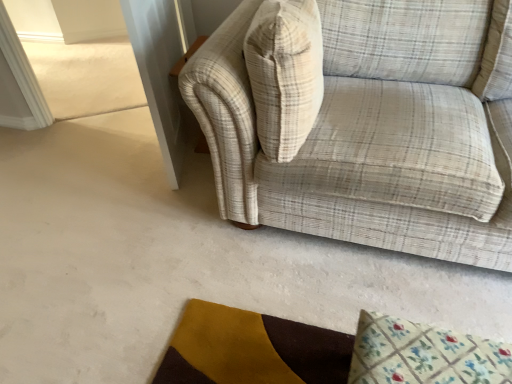
Question: Does plaid fabric couch at upper right have a greater height compared to floral fabric mat at lower right?

Choices:
 (A) no
 (B) yes

Answer: (B)

Question: Is the surface of plaid fabric couch at upper right in direct contact with floral fabric mat at lower right?

Choices:
 (A) no
 (B) yes

Answer: (A)

Question: From the image's perspective, is plaid fabric couch at upper right over floral fabric mat at lower right?

Choices:
 (A) yes
 (B) no

Answer: (A)

Question: Is plaid fabric couch at upper right behind floral fabric mat at lower right?

Choices:
 (A) yes
 (B) no

Answer: (B)

Question: Considering the relative sizes of plaid fabric couch at upper right and floral fabric mat at lower right in the image provided, is plaid fabric couch at upper right shorter than floral fabric mat at lower right?

Choices:
 (A) yes
 (B) no

Answer: (B)

Question: Is floral fabric mat at lower right a part of plaid fabric couch at upper right?

Choices:
 (A) no
 (B) yes

Answer: (A)

Question: Is plaid fabric couch at upper right directly adjacent to beige plaid throw pillow at upper right?

Choices:
 (A) no
 (B) yes

Answer: (A)

Question: Considering the relative positions of plaid fabric couch at upper right and beige plaid throw pillow at upper right in the image provided, is plaid fabric couch at upper right to the left of beige plaid throw pillow at upper right from the viewer's perspective?

Choices:
 (A) no
 (B) yes

Answer: (A)

Question: Is plaid fabric couch at upper right aimed at beige plaid throw pillow at upper right?

Choices:
 (A) yes
 (B) no

Answer: (A)

Question: From the image's perspective, is plaid fabric couch at upper right beneath beige plaid throw pillow at upper right?

Choices:
 (A) no
 (B) yes

Answer: (B)

Question: From a real-world perspective, is plaid fabric couch at upper right located higher than beige plaid throw pillow at upper right?

Choices:
 (A) yes
 (B) no

Answer: (B)

Question: Considering the relative positions of plaid fabric couch at upper right and beige plaid throw pillow at upper right in the image provided, is plaid fabric couch at upper right behind beige plaid throw pillow at upper right?

Choices:
 (A) yes
 (B) no

Answer: (B)

Question: From the image's perspective, is beige plaid throw pillow at upper right above plaid fabric couch at upper right?

Choices:
 (A) yes
 (B) no

Answer: (A)